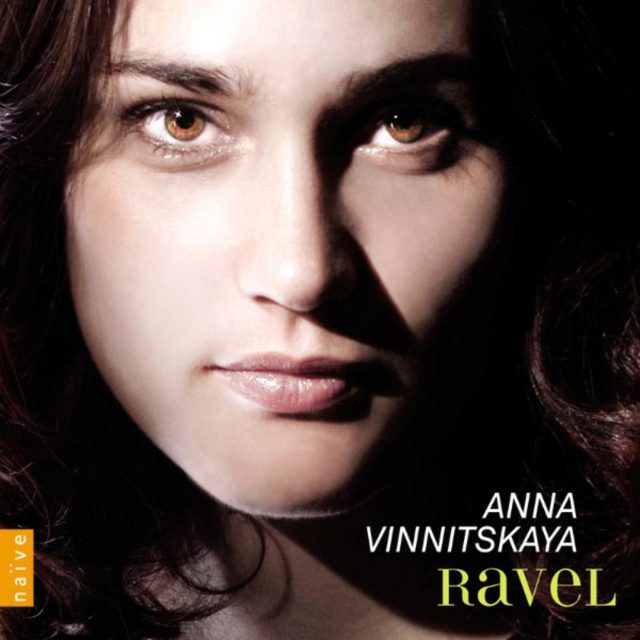
Is smooth skin face at center positioned before brown glossy eye at upper center?

Yes, it is.

Is smooth skin face at center wider than brown glossy eye at upper center?

Indeed, smooth skin face at center has a greater width compared to brown glossy eye at upper center.

Image resolution: width=640 pixels, height=640 pixels. In order to click on smooth skin face at center in this screenshot , I will do `click(280, 243)`.

Can you confirm if smooth skin face at center is positioned below brown matte eye at upper left?

Yes, smooth skin face at center is below brown matte eye at upper left.

From the picture: Between smooth skin face at center and brown matte eye at upper left, which one is positioned higher?

brown matte eye at upper left is higher up.

Is point (481, 250) positioned after point (150, 113)?

Yes, it is behind point (150, 113).

Locate an element on the screen. The image size is (640, 640). smooth skin face at center is located at coordinates (280, 243).

Between brown glossy eye at upper center and brown matte eye at upper left, which one is positioned lower?

brown glossy eye at upper center is below.

From the picture: Between brown glossy eye at upper center and brown matte eye at upper left, which one is positioned higher?

brown matte eye at upper left is above.

You are a GUI agent. You are given a task and a screenshot of the screen. Output one action in this format:
    pyautogui.click(x=<x>, y=<y>)
    Task: Click on the brown glossy eye at upper center
    
    Given the screenshot: What is the action you would take?
    pyautogui.click(x=410, y=132)

Where is `brown glossy eye at upper center`? brown glossy eye at upper center is located at coordinates (410, 132).